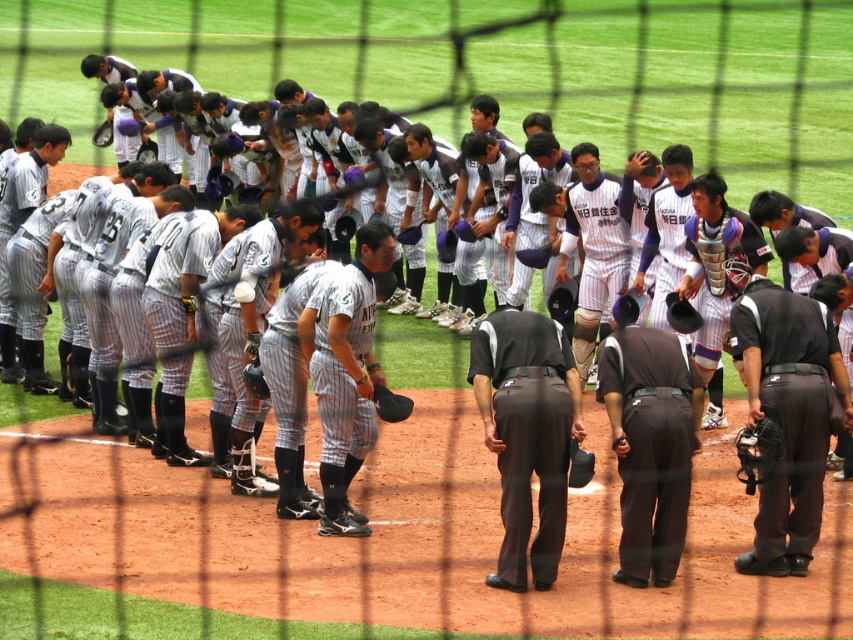
You are a photographer trying to capture a closeup shot of the black leather baseball glove at center without including the black matte uniform at center in the frame. Given their sizes, is this possible?

The black matte uniform at center is larger in size than the black leather baseball glove at center, so it might be challenging to frame the glove without including the uniform due to its larger size taking up more space in the image.

You are a photographer trying to capture a clear shot of the dark brown uniform at center and the striped fabric baseball uniform at center through the netting. Since the netting might block part of the view, which uniform would you focus on to ensure it appears larger in your photo?

Answer: The dark brown uniform at center is bigger than the striped fabric baseball uniform at center, so focusing on it would ensure a larger appearance in the photo.

You are a photographer trying to capture a clear shot of the dark gray pants at center and the dark brown uniform at center through the netting. Which object will appear smaller in your photo?

The dark gray pants at center will appear smaller in the photo because it has a smaller size compared to the dark brown uniform at center.